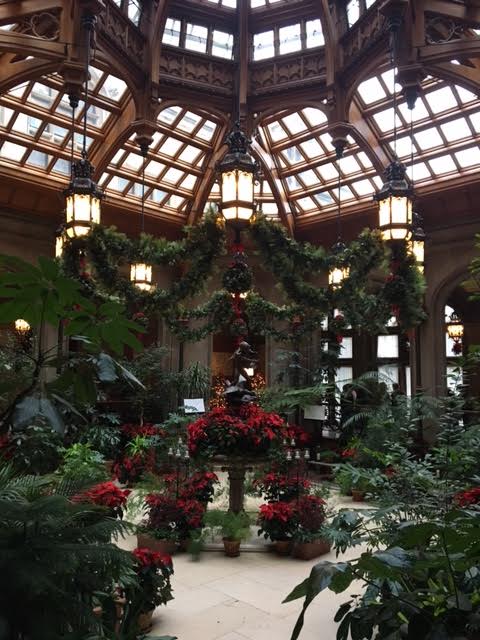
Find the location of a particular element. multi-paned skylight panels, top is located at coordinates (427, 147), (335, 180), (171, 153), (40, 123), (312, 140).